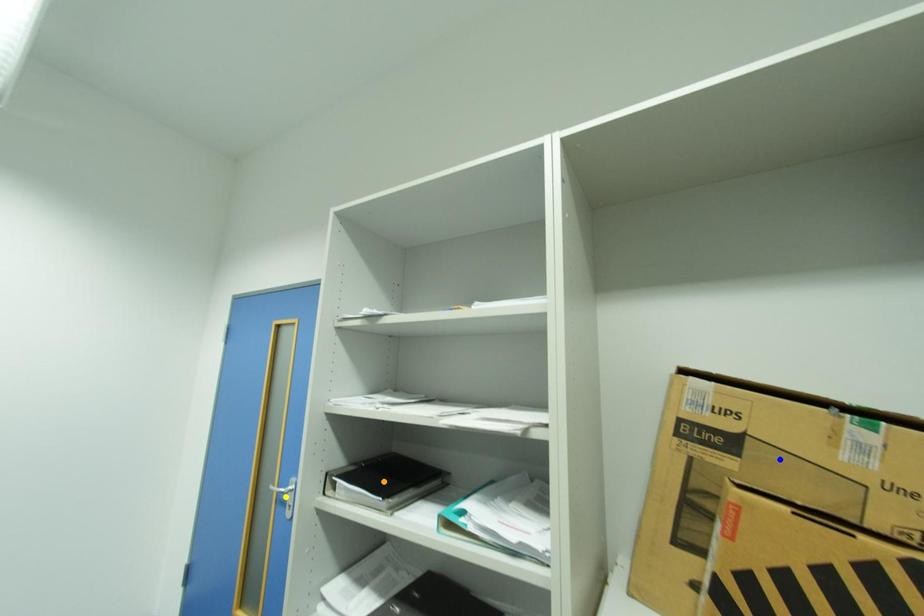
Consider the image. Order these from nearest to farthest:
blue point
orange point
yellow point

1. blue point
2. orange point
3. yellow point